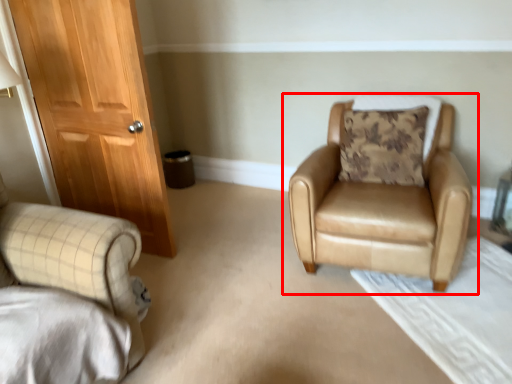
Question: From the image's perspective, what is the correct spatial relationship of chair (annotated by the red box) in relation to pillow?

Choices:
 (A) below
 (B) above

Answer: (A)